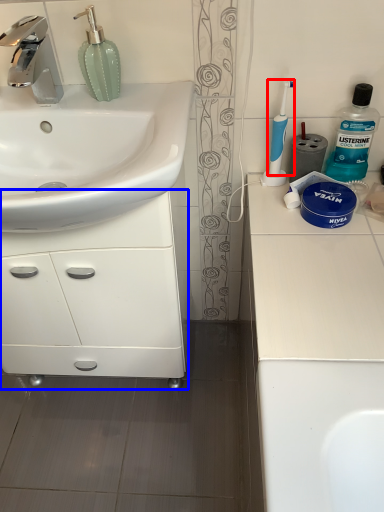
Question: Which object is further to the camera taking this photo, toothbrush (highlighted by a red box) or bathroom cabinet (highlighted by a blue box)?

Choices:
 (A) toothbrush
 (B) bathroom cabinet

Answer: (A)